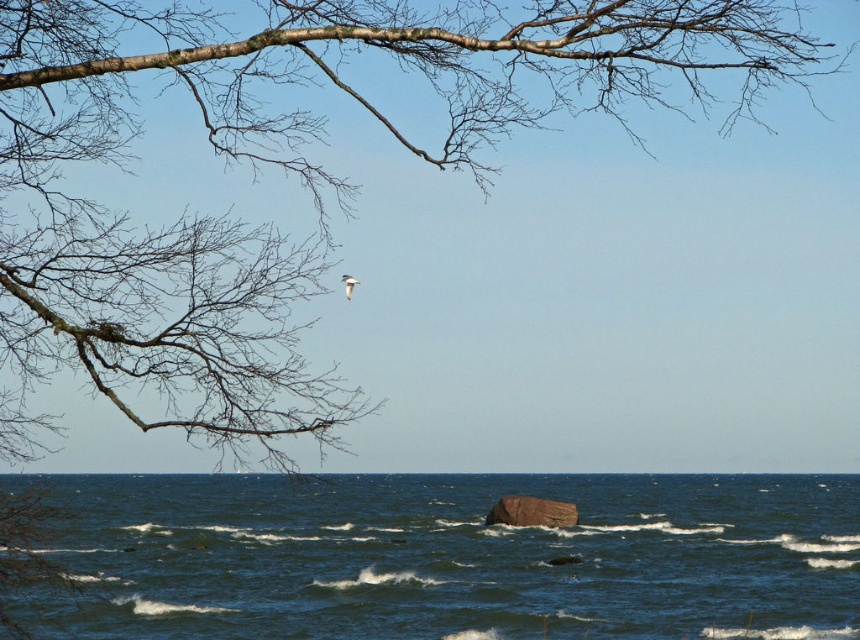
Question: In this image, where is dark blue water at center located relative to brown rough rock at center?

Choices:
 (A) below
 (B) above

Answer: (B)

Question: Does dark blue water at center have a lesser width compared to brown rough rock at center?

Choices:
 (A) no
 (B) yes

Answer: (A)

Question: Which point is closer to the camera?

Choices:
 (A) (179, 520)
 (B) (561, 524)

Answer: (B)

Question: Which of the following is the closest to the observer?

Choices:
 (A) (556, 508)
 (B) (713, 604)

Answer: (B)

Question: Which object appears farthest from the camera in this image?

Choices:
 (A) brown rough rock at center
 (B) dark blue water at center

Answer: (A)

Question: Is dark blue water at center wider than brown rough rock at center?

Choices:
 (A) yes
 (B) no

Answer: (A)